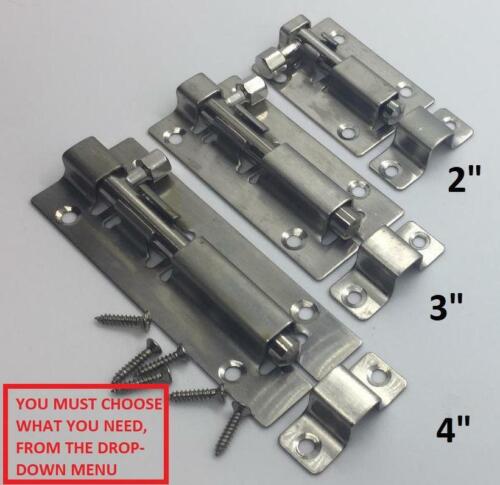
Image resolution: width=500 pixels, height=485 pixels. What are the coordinates of `four inch lock` in the screenshot? It's located at (127, 276).